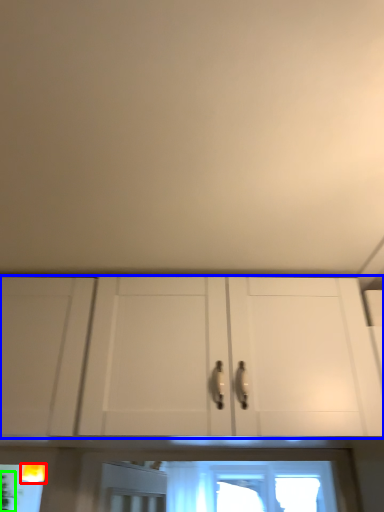
Question: Which is farther away from light fixture (highlighted by a red box)? cabinetry (highlighted by a blue box) or plant (highlighted by a green box)?

Choices:
 (A) cabinetry
 (B) plant

Answer: (A)